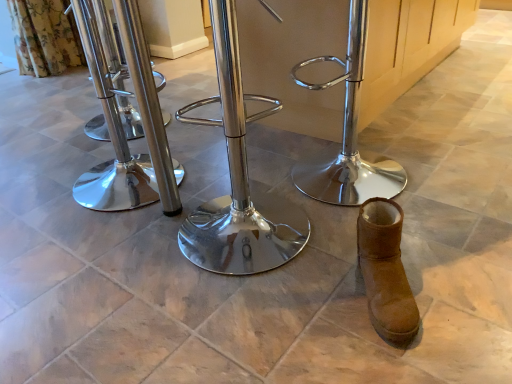
The width and height of the screenshot is (512, 384). In order to click on vacant area that is in front of polished metal swivel chair at center, positioned as the 1th swivel chair in right-to-left order in this screenshot , I will do `click(399, 238)`.